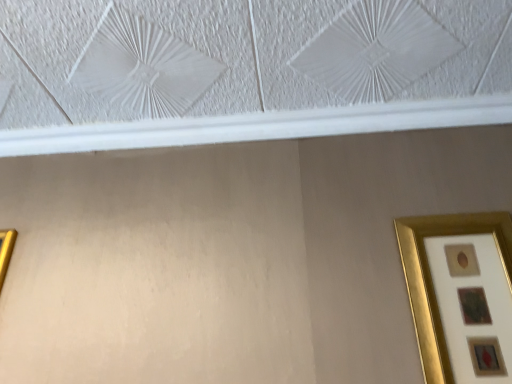
Question: Can you confirm if gold metallic picture frame at right, the 2th picture frame in the left-to-right sequence, is shorter than gold metallic picture frame at left, positioned as the 2th picture frame in right-to-left order?

Choices:
 (A) yes
 (B) no

Answer: (B)

Question: Is gold metallic picture frame at right, the 2th picture frame in the left-to-right sequence, at the left side of gold metallic picture frame at left, acting as the 1th picture frame starting from the left?

Choices:
 (A) yes
 (B) no

Answer: (B)

Question: From a real-world perspective, is gold metallic picture frame at right, which is the first picture frame in right-to-left order, positioned under gold metallic picture frame at left, positioned as the 2th picture frame in right-to-left order, based on gravity?

Choices:
 (A) no
 (B) yes

Answer: (B)

Question: Is gold metallic picture frame at right, the 2th picture frame in the left-to-right sequence, facing towards gold metallic picture frame at left, acting as the 1th picture frame starting from the left?

Choices:
 (A) no
 (B) yes

Answer: (A)

Question: Is gold metallic picture frame at right, which is the first picture frame in right-to-left order, at the right side of gold metallic picture frame at left, acting as the 1th picture frame starting from the left?

Choices:
 (A) no
 (B) yes

Answer: (B)

Question: From a real-world perspective, is gold metallic picture frame at right, the 2th picture frame in the left-to-right sequence, physically above gold metallic picture frame at left, acting as the 1th picture frame starting from the left?

Choices:
 (A) yes
 (B) no

Answer: (B)

Question: From the image's perspective, is gold metallic picture frame at left, acting as the 1th picture frame starting from the left, above gold metallic picture frame at right, the 2th picture frame in the left-to-right sequence?

Choices:
 (A) yes
 (B) no

Answer: (B)

Question: From a real-world perspective, is gold metallic picture frame at left, acting as the 1th picture frame starting from the left, under gold metallic picture frame at right, the 2th picture frame in the left-to-right sequence?

Choices:
 (A) no
 (B) yes

Answer: (A)

Question: Is gold metallic picture frame at left, positioned as the 2th picture frame in right-to-left order, to the right of gold metallic picture frame at right, the 2th picture frame in the left-to-right sequence, from the viewer's perspective?

Choices:
 (A) no
 (B) yes

Answer: (A)

Question: Is gold metallic picture frame at left, positioned as the 2th picture frame in right-to-left order, thinner than gold metallic picture frame at right, the 2th picture frame in the left-to-right sequence?

Choices:
 (A) no
 (B) yes

Answer: (B)

Question: Does gold metallic picture frame at left, acting as the 1th picture frame starting from the left, have a smaller size compared to gold metallic picture frame at right, which is the first picture frame in right-to-left order?

Choices:
 (A) yes
 (B) no

Answer: (B)

Question: Considering the relative sizes of gold metallic picture frame at left, acting as the 1th picture frame starting from the left, and gold metallic picture frame at right, which is the first picture frame in right-to-left order, in the image provided, is gold metallic picture frame at left, acting as the 1th picture frame starting from the left, bigger than gold metallic picture frame at right, which is the first picture frame in right-to-left order,?

Choices:
 (A) no
 (B) yes

Answer: (B)

Question: Considering their positions, is gold metallic picture frame at right, the 2th picture frame in the left-to-right sequence, located in front of or behind gold metallic picture frame at left, acting as the 1th picture frame starting from the left?

Choices:
 (A) behind
 (B) front

Answer: (B)